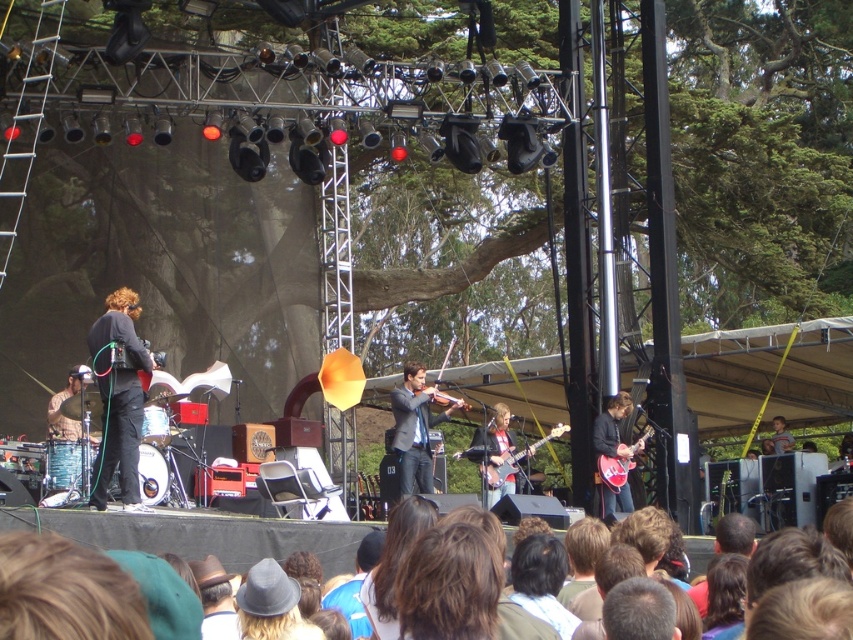
Question: Is brown hair at lower center thinner than matte red electric guitar at center right?

Choices:
 (A) yes
 (B) no

Answer: (B)

Question: Does matte black violin at center have a greater width compared to matte black electric guitar at center?

Choices:
 (A) no
 (B) yes

Answer: (A)

Question: Which point is farther to the camera?

Choices:
 (A) (242, 538)
 (B) (596, 422)
 (C) (393, 400)
 (D) (508, 474)

Answer: (D)

Question: Estimate the real-world distances between objects in this image. Which object is closer to the brown hair at lower center?

Choices:
 (A) wooden violin at center
 (B) matte pink guitar at center

Answer: (B)

Question: Which of the following is the closest to the observer?

Choices:
 (A) (618, 483)
 (B) (606, 426)

Answer: (A)

Question: Is matte black electric guitar at center thinner than matte red electric guitar at center right?

Choices:
 (A) yes
 (B) no

Answer: (B)